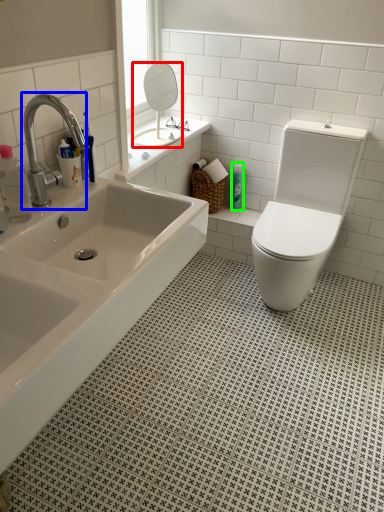
Question: Considering the real-world distances, which object is closest to mirror (highlighted by a red box)? tap (highlighted by a blue box) or toiletry (highlighted by a green box).

Choices:
 (A) tap
 (B) toiletry

Answer: (B)